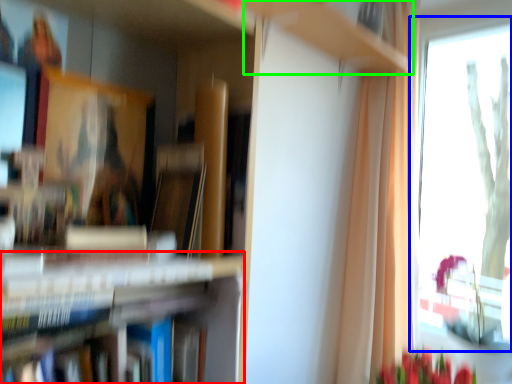
Question: Which object is the farthest from bookshelf (highlighted by a red box)? Choose among these: window (highlighted by a blue box) or cabinet (highlighted by a green box).

Choices:
 (A) window
 (B) cabinet

Answer: (A)